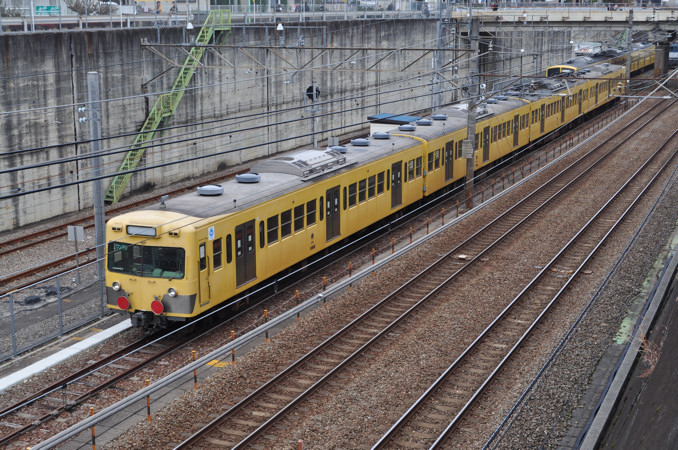
The image size is (678, 450). I want to click on side rail, so click(297, 312).